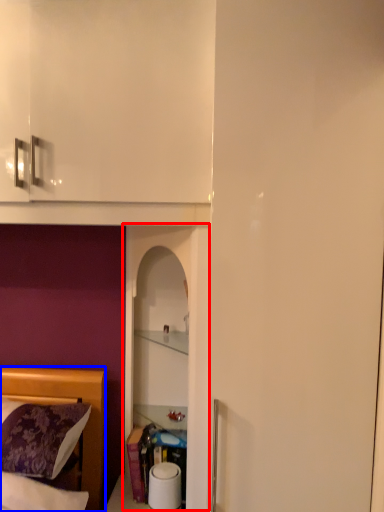
Question: Which of the following is the farthest to the observer, glass door (highlighted by a red box) or bed (highlighted by a blue box)?

Choices:
 (A) glass door
 (B) bed

Answer: (A)